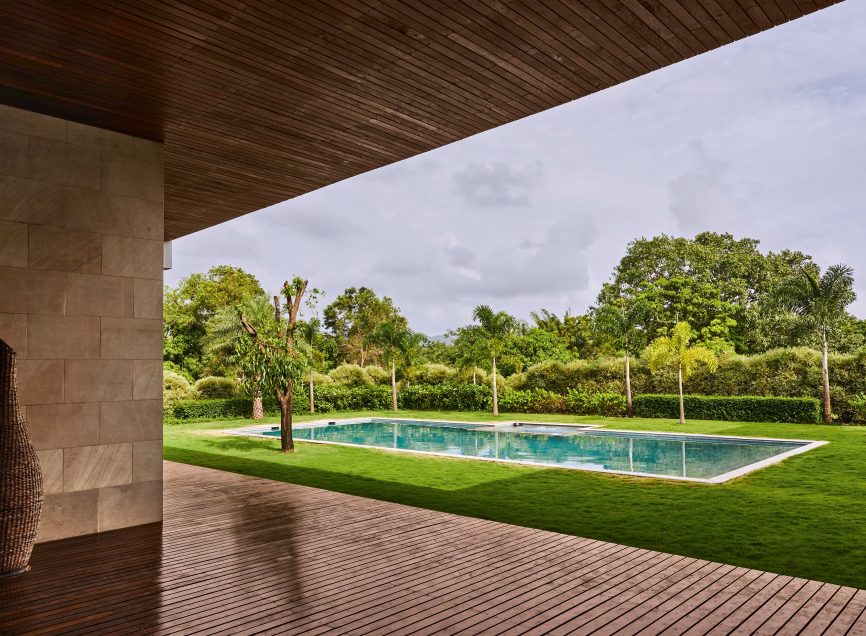
Where is `wood panel floor`? This screenshot has height=636, width=866. wood panel floor is located at coordinates pos(450,569).